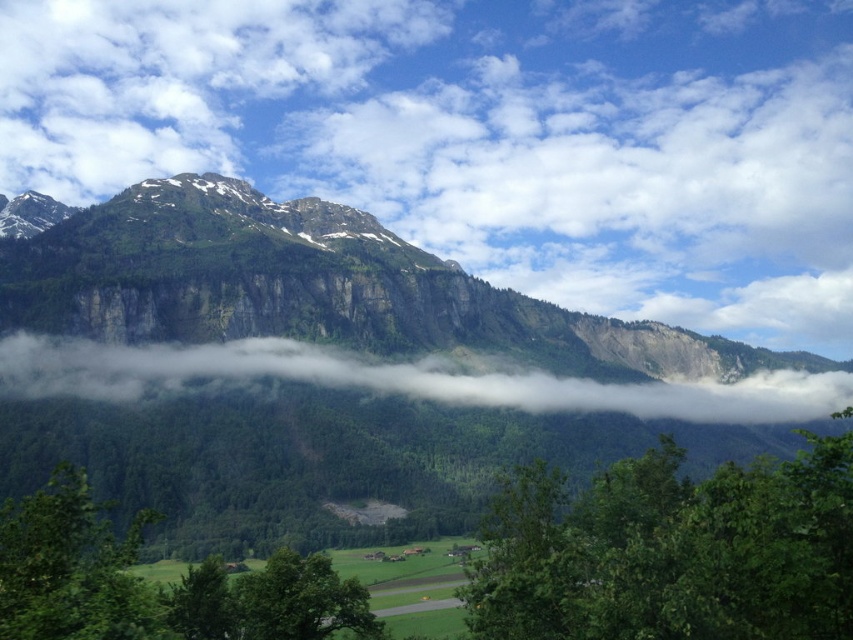
Question: Observing the image, what is the correct spatial positioning of green leafy tree at lower left in reference to green leafy tree at lower center?

Choices:
 (A) left
 (B) right

Answer: (A)

Question: Which of the following is the farthest from the observer?

Choices:
 (A) green rocky mountain range at upper center
 (B) green leafy tree at lower center
 (C) green leafy tree at lower left

Answer: (A)

Question: Among these objects, which one is nearest to the camera?

Choices:
 (A) green leafy tree at lower right
 (B) green leafy tree at lower center

Answer: (A)

Question: Is white fluffy fog at center below green leafy tree at lower center?

Choices:
 (A) yes
 (B) no

Answer: (B)

Question: Which of the following is the farthest from the observer?

Choices:
 (A) green leafy tree at lower left
 (B) white fluffy cloud at upper center

Answer: (B)

Question: Is white fluffy cloud at upper center to the left of green leafy tree at lower left from the viewer's perspective?

Choices:
 (A) yes
 (B) no

Answer: (B)